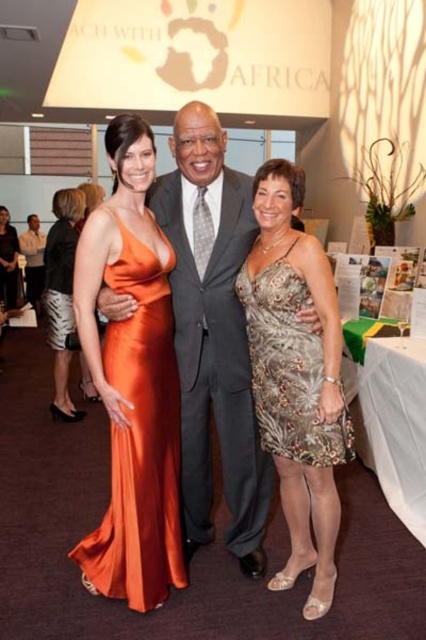
Does silver sequined dress at center have a lesser height compared to matte gray suit at center?

Yes.

Which of these two, silver sequined dress at center or matte gray suit at center, stands shorter?

Standing shorter between the two is silver sequined dress at center.

Is point (302, 355) farther from viewer compared to point (39, 244)?

That is False.

I want to click on silver sequined dress at center, so click(288, 369).

Is silver sequined dress at center wider than orange satin dress at left?

Incorrect, silver sequined dress at center's width does not surpass orange satin dress at left's.

Can you confirm if silver sequined dress at center is smaller than orange satin dress at left?

Yes.

Is point (279, 300) positioned before point (49, 291)?

Yes.

I want to click on silver sequined dress at center, so click(288, 369).

Is point (273, 282) positioned after point (275, 324)?

No, (273, 282) is closer to viewer.

Can you confirm if satin dress at center is smaller than silver sequined dress at center?

No.

Does point (327, 529) come behind point (339, 392)?

Yes.

Find the location of a particular element. The image size is (426, 640). satin dress at center is located at coordinates (253, 362).